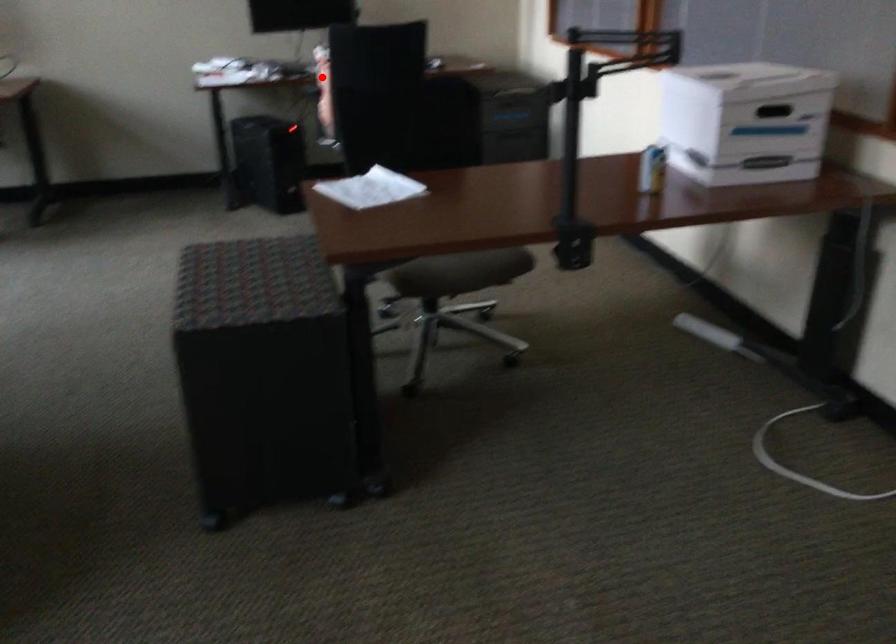
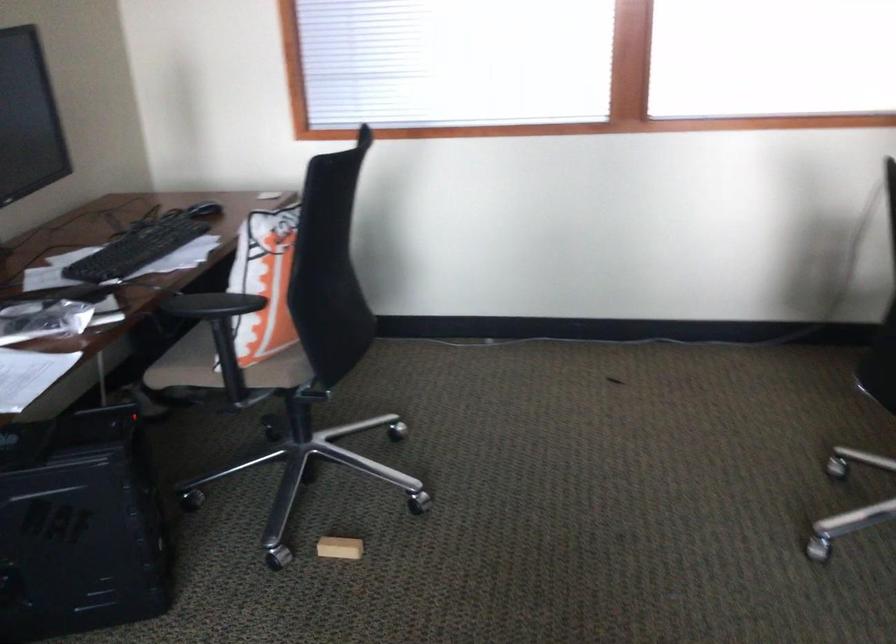
In the second image, find the point that corresponds to the highlighted location in the first image.

(211, 305)